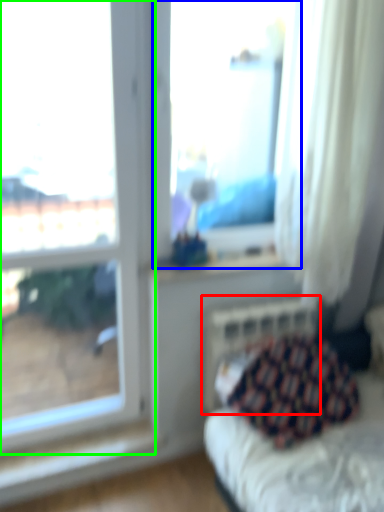
Question: Which is farther away from radiator (highlighted by a red box)? window (highlighted by a blue box) or window (highlighted by a green box)?

Choices:
 (A) window
 (B) window

Answer: (A)